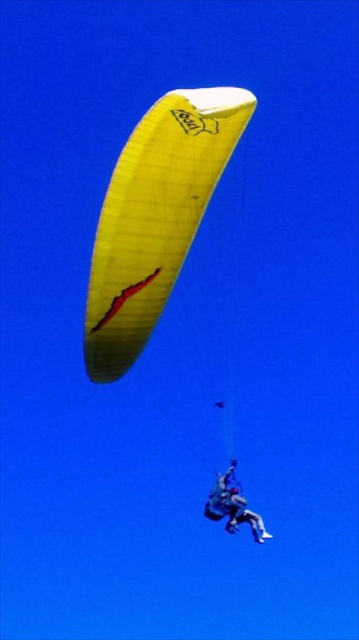
You are a photographer trying to capture the paraglider from the ground. You notice the yellow mesh parachute at upper center and the matte blue jumpsuit at center. Which object will appear closer to you in the photo?

The yellow mesh parachute at upper center will appear closer to you in the photo because it is in front of the matte blue jumpsuit at center.

You are a photographer trying to capture the paraglider in flight. You want to ensure the yellow mesh parachute at upper center and the matte blue jumpsuit at center are both visible in your shot. Given their sizes, which object will take up more space in the photo?

The yellow mesh parachute at upper center will take up more space in the photo because its width is larger than that of the matte blue jumpsuit at center.

You are a photographer trying to capture the paraglider from the ground. You want to ensure the yellow mesh parachute at upper center and the matte blue jumpsuit at center are both visible in the photo. Which object should you focus on first to ensure both are in frame?

The yellow mesh parachute at upper center is positioned over the matte blue jumpsuit at center, so focusing on the parachute first will ensure both objects remain visible in the frame.